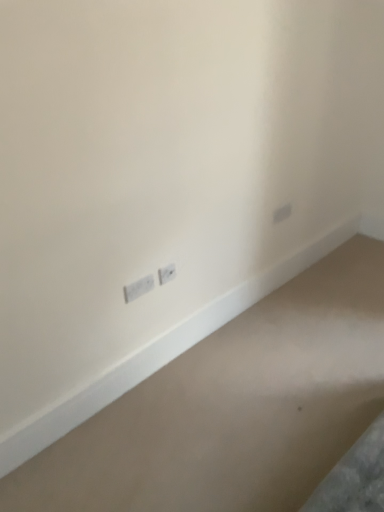
Question: Is white plastic power plugs and sockets at center, which is the first power plugs and sockets from right to left, to the left of smooth beige carpet at bottom from the viewer's perspective?

Choices:
 (A) no
 (B) yes

Answer: (B)

Question: From a real-world perspective, is white plastic power plugs and sockets at center, the 2th power plugs and sockets in the left-to-right sequence, positioned over smooth beige carpet at bottom based on gravity?

Choices:
 (A) yes
 (B) no

Answer: (A)

Question: Can you confirm if white plastic power plugs and sockets at center, which is the first power plugs and sockets from right to left, is taller than smooth beige carpet at bottom?

Choices:
 (A) no
 (B) yes

Answer: (B)

Question: Does white plastic power plugs and sockets at center, which is the first power plugs and sockets from right to left, appear on the right side of smooth beige carpet at bottom?

Choices:
 (A) no
 (B) yes

Answer: (A)

Question: From the image's perspective, is white plastic power plugs and sockets at center, which is the first power plugs and sockets from right to left, located above smooth beige carpet at bottom?

Choices:
 (A) no
 (B) yes

Answer: (B)

Question: Does white plastic power plugs and sockets at center, which is the first power plugs and sockets from right to left, have a larger size compared to smooth beige carpet at bottom?

Choices:
 (A) no
 (B) yes

Answer: (A)

Question: Can you confirm if white plastic power plugs and sockets at center, which is the first power plugs and sockets from right to left, is positioned to the left of white plastic power plugs and sockets at lower left, the 1th power plugs and sockets positioned from the left?

Choices:
 (A) no
 (B) yes

Answer: (A)

Question: Is white plastic power plugs and sockets at lower left, the 2th power plugs and sockets when ordered from right to left, at the back of white plastic power plugs and sockets at center, which is the first power plugs and sockets from right to left?

Choices:
 (A) no
 (B) yes

Answer: (A)

Question: Considering the relative sizes of white plastic power plugs and sockets at center, which is the first power plugs and sockets from right to left, and white plastic power plugs and sockets at lower left, the 1th power plugs and sockets positioned from the left, in the image provided, is white plastic power plugs and sockets at center, which is the first power plugs and sockets from right to left, taller than white plastic power plugs and sockets at lower left, the 1th power plugs and sockets positioned from the left,?

Choices:
 (A) no
 (B) yes

Answer: (B)

Question: From the image's perspective, does white plastic power plugs and sockets at center, the 2th power plugs and sockets in the left-to-right sequence, appear lower than white plastic power plugs and sockets at lower left, the 1th power plugs and sockets positioned from the left?

Choices:
 (A) yes
 (B) no

Answer: (B)

Question: From a real-world perspective, is white plastic power plugs and sockets at center, the 2th power plugs and sockets in the left-to-right sequence, positioned under white plastic power plugs and sockets at lower left, the 1th power plugs and sockets positioned from the left, based on gravity?

Choices:
 (A) no
 (B) yes

Answer: (A)

Question: Is white plastic power plugs and sockets at center, the 2th power plugs and sockets in the left-to-right sequence, wider than white plastic power plugs and sockets at lower left, the 2th power plugs and sockets when ordered from right to left?

Choices:
 (A) yes
 (B) no

Answer: (B)

Question: Considering the relative positions of smooth beige carpet at bottom and white plastic power plugs and sockets at lower left, the 2th power plugs and sockets when ordered from right to left, in the image provided, is smooth beige carpet at bottom behind white plastic power plugs and sockets at lower left, the 2th power plugs and sockets when ordered from right to left,?

Choices:
 (A) no
 (B) yes

Answer: (A)